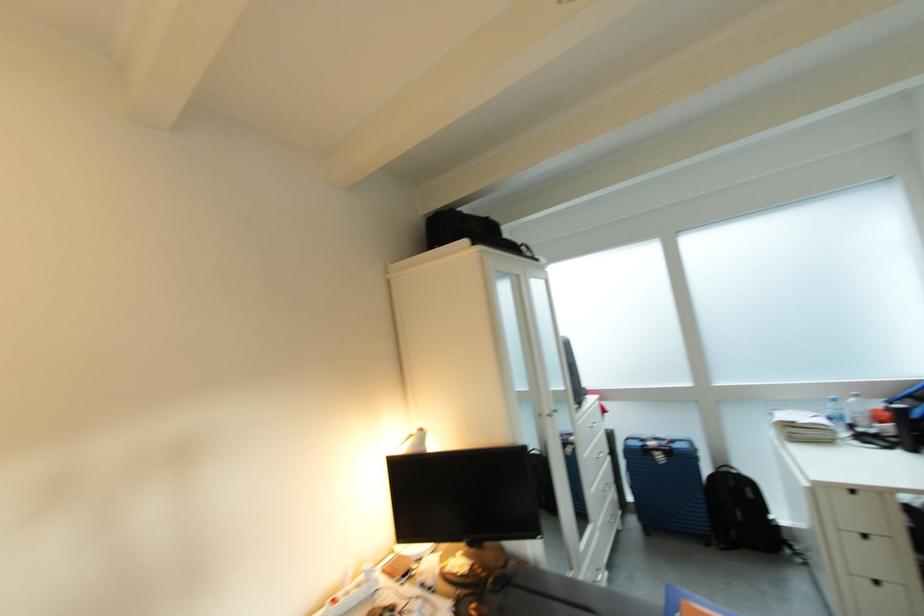
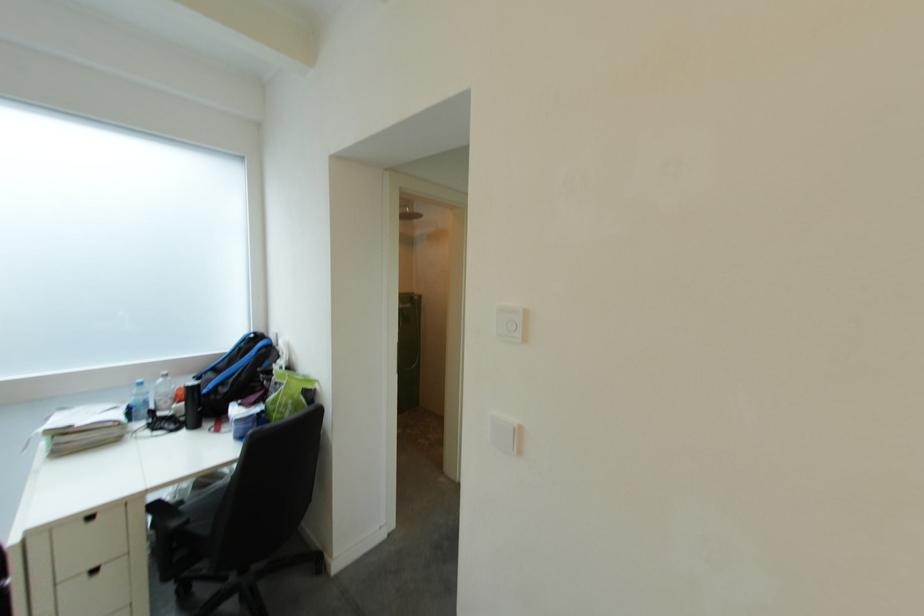
Find the pixel in the second image that matches point (804, 428) in the first image.

(73, 436)